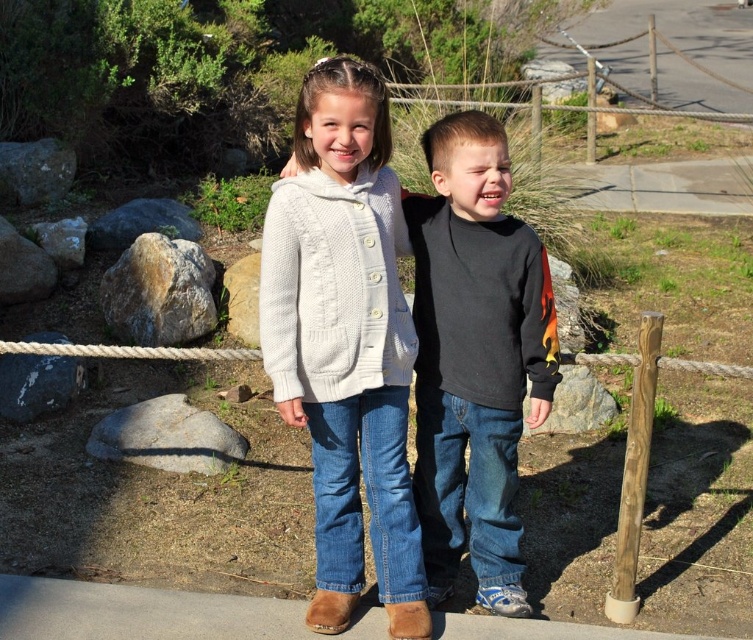
Question: Is black matte shirt at center further to the viewer compared to white rope at center?

Choices:
 (A) yes
 (B) no

Answer: (B)

Question: Which object is closer to the camera taking this photo?

Choices:
 (A) black matte shirt at center
 (B) white knitted cardigan at center

Answer: (B)

Question: Which point is closer to the camera taking this photo?

Choices:
 (A) [456, 352]
 (B) [166, 353]
 (C) [639, 406]

Answer: (A)

Question: Which of the following is the farthest from the observer?

Choices:
 (A) black matte shirt at center
 (B) brown wooden pole at right
 (C) white knitted cardigan at center
 (D) white rope at center

Answer: (D)

Question: Is brown wooden pole at right smaller than white rope at center?

Choices:
 (A) no
 (B) yes

Answer: (A)

Question: Observing the image, what is the correct spatial positioning of white knitted cardigan at center in reference to black matte shirt at center?

Choices:
 (A) above
 (B) below

Answer: (A)